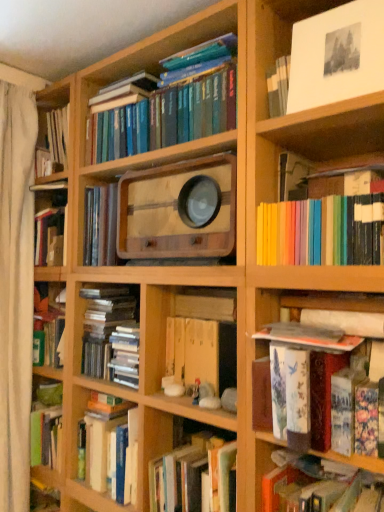
You are a GUI agent. You are given a task and a screenshot of the screen. Output one action in this format:
    pyautogui.click(x=<x>, y=<y>)
    Task: Click on the hardcover book at lower right, which is the 5th book from top to bottom
    The image size is (384, 512).
    Given the screenshot: What is the action you would take?
    pyautogui.click(x=316, y=487)

The image size is (384, 512). Describe the element at coordinates (324, 220) in the screenshot. I see `rainbow-colored paper at upper right, marked as the third book in a top-to-bottom arrangement` at that location.

Image resolution: width=384 pixels, height=512 pixels. I want to click on blue hardcover books at upper center, which is the 1th book in top-to-bottom order, so click(x=168, y=104).

Find the location of `hardcover book at lower right, which is the 5th book from top to bottom`. hardcover book at lower right, which is the 5th book from top to bottom is located at coordinates (316, 487).

Is white paper at upper right completely or partially inside hardcover book at lower right, acting as the first book starting from the bottom?

No, hardcover book at lower right, acting as the first book starting from the bottom, does not contain white paper at upper right.

Locate an element on the screen. The height and width of the screenshot is (512, 384). book that is the 5th object located below the white paper at upper right (from the image's perspective) is located at coordinates (316, 487).

Considering the sizes of objects hardcover book at lower right, acting as the first book starting from the bottom, and white paper at upper right in the image provided, who is taller, hardcover book at lower right, acting as the first book starting from the bottom, or white paper at upper right?

white paper at upper right.

Is the depth of blue hardcover books at upper center, which is the 1th book in top-to-bottom order, less than that of white paper at upper right?

That is False.

In the image, is blue hardcover books at upper center, which is the 1th book in top-to-bottom order, on the left side or the right side of white paper at upper right?

From the image, it's evident that blue hardcover books at upper center, which is the 1th book in top-to-bottom order, is to the left of white paper at upper right.

Is blue hardcover books at upper center, the 5th book when ordered from bottom to top, positioned with its back to white paper at upper right?

No, blue hardcover books at upper center, the 5th book when ordered from bottom to top, is not facing the opposite direction of white paper at upper right.

From the image's perspective, between blue hardcover books at upper center, which is the 1th book in top-to-bottom order, and white paper at upper right, who is located below?

blue hardcover books at upper center, which is the 1th book in top-to-bottom order, is shown below in the image.

The image size is (384, 512). I want to click on book to the left of blue hardcover books at upper center, which is the 1th book in top-to-bottom order, so click(42, 162).

Which point is more distant from viewer, (171, 94) or (39, 174)?

The point (39, 174) is behind.

Consider the image. From a real-world perspective, is blue hardcover books at upper center, the 5th book when ordered from bottom to top, over hardcover book at upper left, the 4th book in the bottom-to-top sequence?

Yes, from a real-world perspective, blue hardcover books at upper center, the 5th book when ordered from bottom to top, is on top of hardcover book at upper left, the 4th book in the bottom-to-top sequence.

Does white paper at upper right appear on the left side of rainbow-colored paper at upper right, marked as the third book in a top-to-bottom arrangement?

Yes, white paper at upper right is to the left of rainbow-colored paper at upper right, marked as the third book in a top-to-bottom arrangement.

Between white paper at upper right and rainbow-colored paper at upper right, the third book in the bottom-to-top sequence, which one has larger size?

Bigger between the two is rainbow-colored paper at upper right, the third book in the bottom-to-top sequence.

Can you tell me how much white paper at upper right and rainbow-colored paper at upper right, marked as the third book in a top-to-bottom arrangement, differ in facing direction?

The angle between the facing direction of white paper at upper right and the facing direction of rainbow-colored paper at upper right, marked as the third book in a top-to-bottom arrangement, is 0.00243 degrees.

Is white paper at upper right looking in the opposite direction of rainbow-colored paper at upper right, the third book in the bottom-to-top sequence?

No, white paper at upper right's orientation is not away from rainbow-colored paper at upper right, the third book in the bottom-to-top sequence.

How distant is hardcover book at lower right, acting as the first book starting from the bottom, from hardcover book at upper left, the 2th book in the top-to-bottom sequence?

hardcover book at lower right, acting as the first book starting from the bottom, is 1.52 meters from hardcover book at upper left, the 2th book in the top-to-bottom sequence.

Which is less distant, [337,483] or [42,173]?

The point [337,483] is in front.

What's the angular difference between hardcover book at lower right, which is the 5th book from top to bottom, and hardcover book at upper left, the 4th book in the bottom-to-top sequence,'s facing directions?

They differ by 0.00218 degrees in their facing directions.

Is hardcover book at lower right, which is the 5th book from top to bottom, positioned beyond the bounds of hardcover book at upper left, the 4th book in the bottom-to-top sequence?

Yes.

Is hardcover book at center, the second book ordered from the bottom, next to hardcover book at upper left, the 2th book in the top-to-bottom sequence, and touching it?

hardcover book at center, the second book ordered from the bottom, and hardcover book at upper left, the 2th book in the top-to-bottom sequence, are clearly separated.

From a real-world perspective, is hardcover book at center, the fourth book in the top-to-bottom sequence, positioned over hardcover book at upper left, the 2th book in the top-to-bottom sequence, based on gravity?

No, from a real-world perspective, hardcover book at center, the fourth book in the top-to-bottom sequence, is not on top of hardcover book at upper left, the 2th book in the top-to-bottom sequence.

How much distance is there between hardcover book at center, the second book ordered from the bottom, and hardcover book at upper left, the 2th book in the top-to-bottom sequence?

1.34 meters.

Which object is thinner, hardcover book at center, the fourth book in the top-to-bottom sequence, or hardcover book at upper left, the 4th book in the bottom-to-top sequence?

Thinner between the two is hardcover book at upper left, the 4th book in the bottom-to-top sequence.

Is hardcover book at center, the fourth book in the top-to-bottom sequence, smaller than white paper at upper right?

No, hardcover book at center, the fourth book in the top-to-bottom sequence, is not smaller than white paper at upper right.

Considering the positions of objects hardcover book at center, the fourth book in the top-to-bottom sequence, and white paper at upper right in the image provided, who is more to the left, hardcover book at center, the fourth book in the top-to-bottom sequence, or white paper at upper right?

From the viewer's perspective, white paper at upper right appears more on the left side.

Where is `cabinet located on the right of hardcover book at lower right, acting as the first book starting from the bottom`? The height and width of the screenshot is (512, 384). cabinet located on the right of hardcover book at lower right, acting as the first book starting from the bottom is located at coordinates (337, 56).

There is a white paper at upper right. What are the coordinates of `the 1st book below it (from the image's perspective)` in the screenshot? It's located at (168, 104).

Based on their spatial positions, is white paper at upper right or hardcover book at lower right, acting as the first book starting from the bottom, closer to rainbow-colored paper at upper right, the third book in the bottom-to-top sequence?

white paper at upper right is closer to rainbow-colored paper at upper right, the third book in the bottom-to-top sequence.

Looking at the image, which one is located further to white fabric curtain at left, hardcover book at center, the fourth book in the top-to-bottom sequence, or hardcover book at upper left, the 4th book in the bottom-to-top sequence?

hardcover book at center, the fourth book in the top-to-bottom sequence.

Estimate the real-world distances between objects in this image. Which object is closer to rainbow-colored paper at upper right, the third book in the bottom-to-top sequence, hardcover book at center, the second book ordered from the bottom, or blue hardcover books at upper center, which is the 1th book in top-to-bottom order?

Based on the image, hardcover book at center, the second book ordered from the bottom, appears to be nearer to rainbow-colored paper at upper right, the third book in the bottom-to-top sequence.

Considering their positions, is hardcover book at upper left, the 4th book in the bottom-to-top sequence, positioned further to hardcover book at center, the fourth book in the top-to-bottom sequence, than rainbow-colored paper at upper right, marked as the third book in a top-to-bottom arrangement?

hardcover book at upper left, the 4th book in the bottom-to-top sequence, is further to hardcover book at center, the fourth book in the top-to-bottom sequence.

Looking at the image, which one is located further to blue hardcover books at upper center, the 5th book when ordered from bottom to top, hardcover book at center, the fourth book in the top-to-bottom sequence, or white fabric curtain at left?

hardcover book at center, the fourth book in the top-to-bottom sequence, lies further to blue hardcover books at upper center, the 5th book when ordered from bottom to top, than the other object.

Based on their spatial positions, is white fabric curtain at left or hardcover book at center, the second book ordered from the bottom, further from hardcover book at upper left, the 4th book in the bottom-to-top sequence?

Based on the image, hardcover book at center, the second book ordered from the bottom, appears to be further to hardcover book at upper left, the 4th book in the bottom-to-top sequence.

Based on their spatial positions, is white fabric curtain at left or rainbow-colored paper at upper right, the third book in the bottom-to-top sequence, further from hardcover book at center, the second book ordered from the bottom?

Based on the image, white fabric curtain at left appears to be further to hardcover book at center, the second book ordered from the bottom.

Based on the photo, from the image, which object appears to be nearer to white fabric curtain at left, rainbow-colored paper at upper right, marked as the third book in a top-to-bottom arrangement, or hardcover book at lower right, which is the 5th book from top to bottom?

hardcover book at lower right, which is the 5th book from top to bottom, is positioned closer to the anchor white fabric curtain at left.

Where is `book between rainbow-colored paper at upper right, marked as the third book in a top-to-bottom arrangement, and hardcover book at lower right, acting as the first book starting from the bottom, from top to bottom`? book between rainbow-colored paper at upper right, marked as the third book in a top-to-bottom arrangement, and hardcover book at lower right, acting as the first book starting from the bottom, from top to bottom is located at coordinates (346, 327).

Find the location of a particular element. This screenshot has width=384, height=512. cabinet between hardcover book at upper left, the 2th book in the top-to-bottom sequence, and hardcover book at center, the second book ordered from the bottom, in the horizontal direction is located at coordinates (337, 56).

Where is `cabinet between hardcover book at upper left, the 4th book in the bottom-to-top sequence, and rainbow-colored paper at upper right, the third book in the bottom-to-top sequence, in the horizontal direction`? This screenshot has width=384, height=512. cabinet between hardcover book at upper left, the 4th book in the bottom-to-top sequence, and rainbow-colored paper at upper right, the third book in the bottom-to-top sequence, in the horizontal direction is located at coordinates (337, 56).

You are a GUI agent. You are given a task and a screenshot of the screen. Output one action in this format:
    pyautogui.click(x=<x>, y=<y>)
    Task: Click on the cabinet between white fabric curtain at left and hardcover book at center, the second book ordered from the bottom, in the horizontal direction
    This screenshot has width=384, height=512.
    Given the screenshot: What is the action you would take?
    pyautogui.click(x=337, y=56)